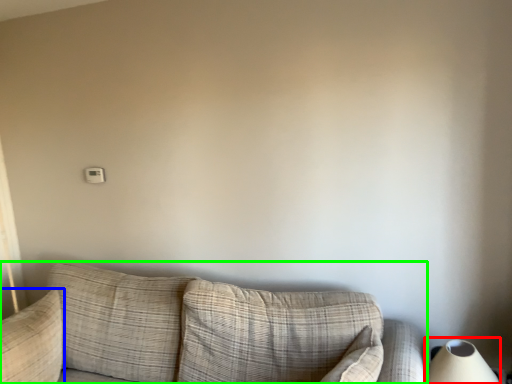
Question: Considering the real-world distances, which object is farthest from table lamp (highlighted by a red box)? pillow (highlighted by a blue box) or studio couch (highlighted by a green box)?

Choices:
 (A) pillow
 (B) studio couch

Answer: (A)